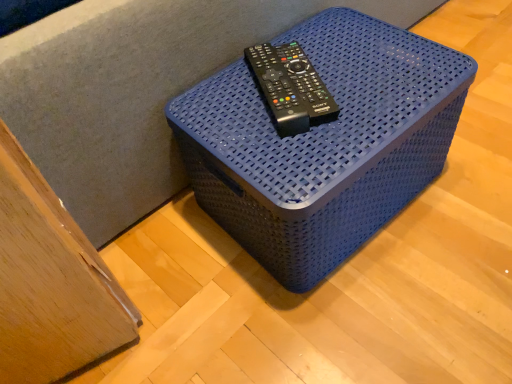
Question: Is black plastic remote control at center facing towards blue woven basket at center?

Choices:
 (A) yes
 (B) no

Answer: (B)

Question: From the image's perspective, would you say black plastic remote control at center is positioned over blue woven basket at center?

Choices:
 (A) yes
 (B) no

Answer: (A)

Question: Is blue woven basket at center inside black plastic remote control at center?

Choices:
 (A) yes
 (B) no

Answer: (B)

Question: Is black plastic remote control at center positioned before blue woven basket at center?

Choices:
 (A) no
 (B) yes

Answer: (A)

Question: Can you confirm if black plastic remote control at center is taller than blue woven basket at center?

Choices:
 (A) yes
 (B) no

Answer: (B)

Question: Does black plastic remote control at center appear on the right side of blue woven basket at center?

Choices:
 (A) yes
 (B) no

Answer: (B)

Question: Is blue woven basket at center not within black plastic remote control at center?

Choices:
 (A) no
 (B) yes

Answer: (B)

Question: Is blue woven basket at center looking in the opposite direction of black plastic remote control at center?

Choices:
 (A) yes
 (B) no

Answer: (B)

Question: Considering the relative positions of blue woven basket at center and black plastic remote control at center in the image provided, is blue woven basket at center to the right of black plastic remote control at center from the viewer's perspective?

Choices:
 (A) no
 (B) yes

Answer: (B)

Question: Is black plastic remote control at center a part of blue woven basket at center?

Choices:
 (A) no
 (B) yes

Answer: (A)

Question: Considering the relative sizes of blue woven basket at center and black plastic remote control at center in the image provided, is blue woven basket at center taller than black plastic remote control at center?

Choices:
 (A) yes
 (B) no

Answer: (A)

Question: Can you confirm if blue woven basket at center is wider than black plastic remote control at center?

Choices:
 (A) yes
 (B) no

Answer: (A)

Question: From the image's perspective, is blue woven basket at center located above or below black plastic remote control at center?

Choices:
 (A) below
 (B) above

Answer: (A)